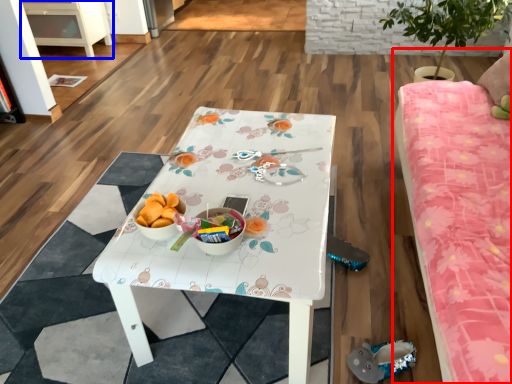
Question: Which point is closer to the camera, studio couch (highlighted by a red box) or cabinetry (highlighted by a blue box)?

Choices:
 (A) studio couch
 (B) cabinetry

Answer: (A)